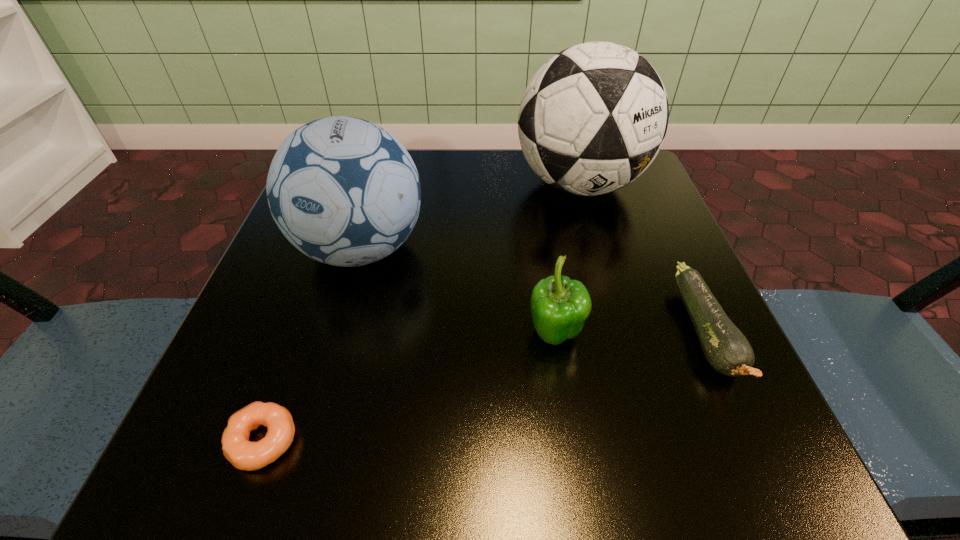
The height and width of the screenshot is (540, 960). In order to click on the right soccer ball in this screenshot , I will do `click(592, 119)`.

Where is `the fourth shortest object`? the fourth shortest object is located at coordinates (344, 191).

Identify the location of the left soccer ball. (344, 191).

Where is `the third shortest object`? The image size is (960, 540). the third shortest object is located at coordinates click(560, 306).

This screenshot has height=540, width=960. In order to click on zucchini in this screenshot , I will do `click(727, 350)`.

I want to click on the nearest object, so click(243, 454).

This screenshot has width=960, height=540. Identify the location of doughnut. (243, 454).

Identify the location of vacant space situated 0.070m on the surface of the right soccer ball where the brand logo is visible. The height and width of the screenshot is (540, 960). (597, 249).

I want to click on vacant space located on the side with brand of the left soccer ball, so click(319, 397).

The image size is (960, 540). In order to click on free space located on the right of the third tallest object in this screenshot , I will do `click(701, 335)`.